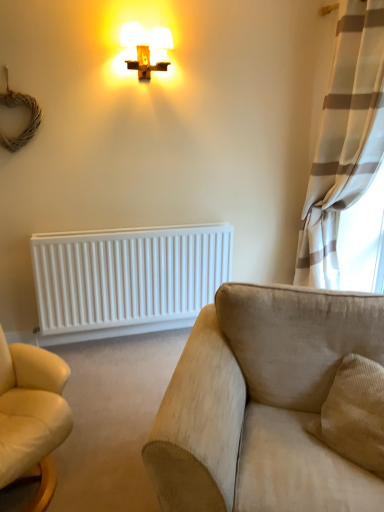
Question: Is beige fabric couch at lower right shorter than matte gold cross at upper center?

Choices:
 (A) no
 (B) yes

Answer: (A)

Question: Is beige fabric couch at lower right taller than matte gold cross at upper center?

Choices:
 (A) no
 (B) yes

Answer: (B)

Question: Are beige fabric couch at lower right and matte gold cross at upper center far apart?

Choices:
 (A) no
 (B) yes

Answer: (B)

Question: Is matte gold cross at upper center surrounded by beige fabric couch at lower right?

Choices:
 (A) no
 (B) yes

Answer: (A)

Question: Does beige fabric couch at lower right have a smaller size compared to matte gold cross at upper center?

Choices:
 (A) yes
 (B) no

Answer: (B)

Question: Can you confirm if beige fabric couch at lower right is positioned to the right of matte gold cross at upper center?

Choices:
 (A) yes
 (B) no

Answer: (A)

Question: From the image's perspective, would you say white textured curtain at right is positioned over beige fabric couch at lower right?

Choices:
 (A) yes
 (B) no

Answer: (A)

Question: Does white textured curtain at right have a larger size compared to beige fabric couch at lower right?

Choices:
 (A) yes
 (B) no

Answer: (B)

Question: Is white textured curtain at right behind beige fabric couch at lower right?

Choices:
 (A) no
 (B) yes

Answer: (B)

Question: Is white textured curtain at right to the right of beige fabric couch at lower right from the viewer's perspective?

Choices:
 (A) yes
 (B) no

Answer: (A)

Question: Is white textured curtain at right positioned in front of beige fabric couch at lower right?

Choices:
 (A) yes
 (B) no

Answer: (B)

Question: From a real-world perspective, is white textured curtain at right on beige fabric couch at lower right?

Choices:
 (A) no
 (B) yes

Answer: (B)

Question: From a real-world perspective, is beige fabric couch at lower right over white matte radiator at lower left?

Choices:
 (A) no
 (B) yes

Answer: (B)